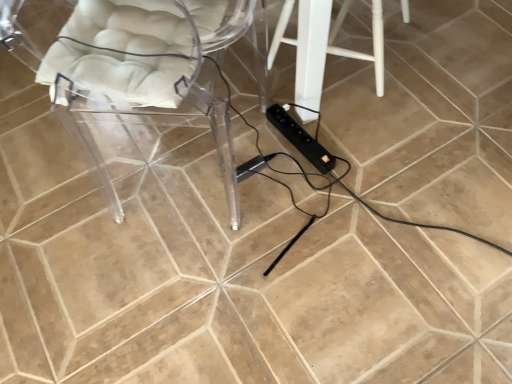
Image resolution: width=512 pixels, height=384 pixels. I want to click on transparent acrylic chair at left, so click(x=143, y=73).

What is the approximate width of black plastic extension cord at center, placed as the second extension cord when sorted from right to left?

It is 5.09 inches.

Locate an element on the screen. black plastic extension cord at center, placed as the second extension cord when sorted from right to left is located at coordinates (252, 166).

Find the location of a particular element. white painted wood stool at center is located at coordinates (323, 46).

Are transparent acrylic chair at left and white painted wood stool at center located far from each other?

They are positioned close to each other.

Is transparent acrylic chair at left in front of or behind white painted wood stool at center in the image?

transparent acrylic chair at left is in front of white painted wood stool at center.

Can you tell me how much transparent acrylic chair at left and white painted wood stool at center differ in facing direction?

transparent acrylic chair at left and white painted wood stool at center are facing 82.7 degrees away from each other.

Measure the distance from transparent acrylic chair at left to white painted wood stool at center.

The distance of transparent acrylic chair at left from white painted wood stool at center is 15.34 inches.

Is white painted wood stool at center directly adjacent to transparent acrylic chair at left?

They are not placed beside each other.

Is white painted wood stool at center positioned with its back to transparent acrylic chair at left?

No, white painted wood stool at center is not facing away from transparent acrylic chair at left.

In the scene shown: Considering the positions of objects white painted wood stool at center and transparent acrylic chair at left in the image provided, who is more to the right, white painted wood stool at center or transparent acrylic chair at left?

From the viewer's perspective, white painted wood stool at center appears more on the right side.

Is point (290, 5) less distant than point (123, 46)?

That is False.

How different are the orientations of transparent acrylic chair at left and black plastic extension cord at center, the 2th extension cord from the left, in degrees?

They differ by 41.7 degrees in their facing directions.

Is transparent acrylic chair at left bigger than black plastic extension cord at center, the 2th extension cord from the left?

Yes, transparent acrylic chair at left is bigger than black plastic extension cord at center, the 2th extension cord from the left.

Is transparent acrylic chair at left beside black plastic extension cord at center, the 2th extension cord from the left?

No, transparent acrylic chair at left is not making contact with black plastic extension cord at center, the 2th extension cord from the left.

Looking at this image, which object is wider, white painted wood stool at center or black plastic extension cord at center, the 1th extension cord in the left-to-right sequence?

white painted wood stool at center is wider.

Is white painted wood stool at center with black plastic extension cord at center, placed as the second extension cord when sorted from right to left?

No, white painted wood stool at center is not beside black plastic extension cord at center, placed as the second extension cord when sorted from right to left.

Which point is more forward, (297, 44) or (270, 154)?

The point (270, 154) is closer.

Is white painted wood stool at center touching black plastic extension cord at center, which appears as the first extension cord when viewed from the right?

No, white painted wood stool at center is not touching black plastic extension cord at center, which appears as the first extension cord when viewed from the right.

Can you confirm if white painted wood stool at center is shorter than black plastic extension cord at center, which appears as the first extension cord when viewed from the right?

No, white painted wood stool at center is not shorter than black plastic extension cord at center, which appears as the first extension cord when viewed from the right.

Which object is positioned more to the left, white painted wood stool at center or black plastic extension cord at center, which appears as the first extension cord when viewed from the right?

black plastic extension cord at center, which appears as the first extension cord when viewed from the right, is more to the left.

Considering the relative sizes of white painted wood stool at center and black plastic extension cord at center, the 2th extension cord from the left, in the image provided, is white painted wood stool at center smaller than black plastic extension cord at center, the 2th extension cord from the left,?

Actually, white painted wood stool at center might be larger than black plastic extension cord at center, the 2th extension cord from the left.

Are black plastic extension cord at center, the 2th extension cord from the left, and white painted wood stool at center far apart?

black plastic extension cord at center, the 2th extension cord from the left, is near white painted wood stool at center, not far away.

Based on the photo, which is correct: black plastic extension cord at center, which appears as the first extension cord when viewed from the right, is inside white painted wood stool at center, or outside of it?

black plastic extension cord at center, which appears as the first extension cord when viewed from the right, exists outside the volume of white painted wood stool at center.

Does black plastic extension cord at center, the 2th extension cord from the left, appear on the left side of white painted wood stool at center?

Indeed, black plastic extension cord at center, the 2th extension cord from the left, is positioned on the left side of white painted wood stool at center.

From the picture: From a real-world perspective, is black plastic extension cord at center, which appears as the first extension cord when viewed from the right, above or below white painted wood stool at center?

black plastic extension cord at center, which appears as the first extension cord when viewed from the right, is below white painted wood stool at center.

From the image's perspective, which is below, black plastic extension cord at center, the 2th extension cord from the left, or transparent acrylic chair at left?

Answer: black plastic extension cord at center, the 2th extension cord from the left, is shown below in the image.

What's the angular difference between black plastic extension cord at center, which appears as the first extension cord when viewed from the right, and transparent acrylic chair at left's facing directions?

The facing directions of black plastic extension cord at center, which appears as the first extension cord when viewed from the right, and transparent acrylic chair at left are 41.7 degrees apart.

At what (x,y) coordinates should I click in order to perform the action: click on furniture behind the transparent acrylic chair at left. Please return your answer as a coordinate pair (x, y). The height and width of the screenshot is (384, 512). Looking at the image, I should click on (323, 46).

You are a GUI agent. You are given a task and a screenshot of the screen. Output one action in this format:
    pyautogui.click(x=<x>, y=<y>)
    Task: Click on the chair in front of the white painted wood stool at center
    This screenshot has width=512, height=384.
    Given the screenshot: What is the action you would take?
    pyautogui.click(x=143, y=73)

Based on their spatial positions, is white painted wood stool at center or transparent acrylic chair at left further from black plastic extension cord at center, the 1th extension cord in the left-to-right sequence?

Among the two, transparent acrylic chair at left is located further to black plastic extension cord at center, the 1th extension cord in the left-to-right sequence.

Considering their positions, is black plastic extension cord at center, the 1th extension cord in the left-to-right sequence, positioned closer to transparent acrylic chair at left than white painted wood stool at center?

The object closer to transparent acrylic chair at left is white painted wood stool at center.

Which object lies further to the anchor point white painted wood stool at center, black plastic extension cord at center, which appears as the first extension cord when viewed from the right, or black plastic extension cord at center, placed as the second extension cord when sorted from right to left?

black plastic extension cord at center, placed as the second extension cord when sorted from right to left, is positioned further to the anchor white painted wood stool at center.

Which object lies further to the anchor point black plastic extension cord at center, the 2th extension cord from the left, black plastic extension cord at center, placed as the second extension cord when sorted from right to left, or white painted wood stool at center?

white painted wood stool at center is positioned further to the anchor black plastic extension cord at center, the 2th extension cord from the left.

Looking at the image, which one is located closer to black plastic extension cord at center, the 1th extension cord in the left-to-right sequence, white painted wood stool at center or black plastic extension cord at center, the 2th extension cord from the left?

Based on the image, black plastic extension cord at center, the 2th extension cord from the left, appears to be nearer to black plastic extension cord at center, the 1th extension cord in the left-to-right sequence.

From the image, which object appears to be farther from transparent acrylic chair at left, white painted wood stool at center or black plastic extension cord at center, which appears as the first extension cord when viewed from the right?

black plastic extension cord at center, which appears as the first extension cord when viewed from the right.

When comparing their distances from white painted wood stool at center, does black plastic extension cord at center, which appears as the first extension cord when viewed from the right, or transparent acrylic chair at left seem further?

transparent acrylic chair at left is positioned further to the anchor white painted wood stool at center.

Based on their spatial positions, is white painted wood stool at center or black plastic extension cord at center, placed as the second extension cord when sorted from right to left, further from black plastic extension cord at center, which appears as the first extension cord when viewed from the right?

white painted wood stool at center.

The height and width of the screenshot is (384, 512). I want to click on furniture located between transparent acrylic chair at left and black plastic extension cord at center, which appears as the first extension cord when viewed from the right, in the depth direction, so click(x=323, y=46).

Where is `furniture positioned between transparent acrylic chair at left and black plastic extension cord at center, placed as the second extension cord when sorted from right to left, from near to far`? The height and width of the screenshot is (384, 512). furniture positioned between transparent acrylic chair at left and black plastic extension cord at center, placed as the second extension cord when sorted from right to left, from near to far is located at coordinates pyautogui.click(x=323, y=46).

Where is `extension cord between transparent acrylic chair at left and black plastic extension cord at center, placed as the second extension cord when sorted from right to left, from front to back`? Image resolution: width=512 pixels, height=384 pixels. extension cord between transparent acrylic chair at left and black plastic extension cord at center, placed as the second extension cord when sorted from right to left, from front to back is located at coordinates (301, 139).

The width and height of the screenshot is (512, 384). I want to click on extension cord between white painted wood stool at center and black plastic extension cord at center, the 1th extension cord in the left-to-right sequence, from top to bottom, so click(301, 139).